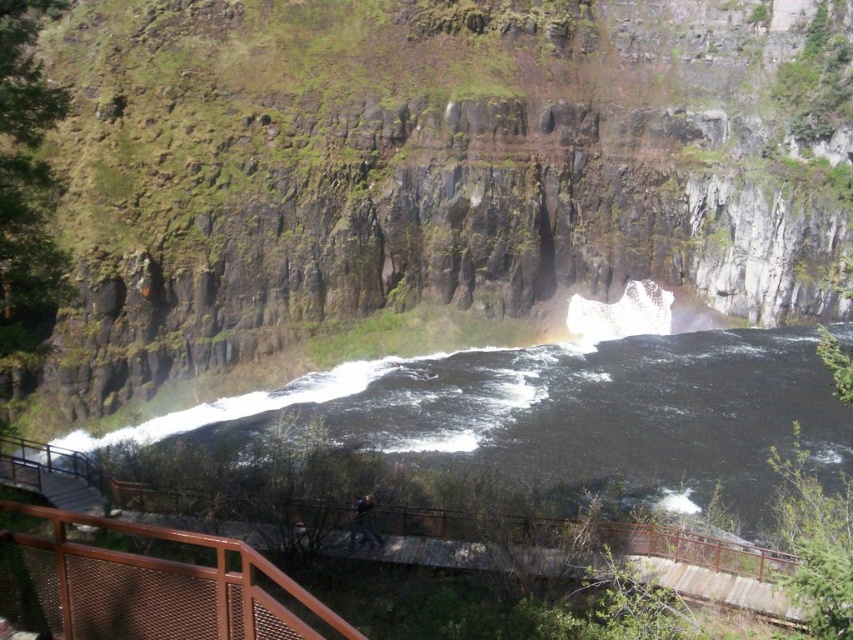
Question: Among these objects, which one is farthest from the camera?

Choices:
 (A) metal mesh railing at lower center
 (B) brown metal/rail at center
 (C) black water at center
 (D) green mossy rock at upper center

Answer: (D)

Question: Estimate the real-world distances between objects in this image. Which object is closer to the metal mesh railing at lower center?

Choices:
 (A) brown metal/rail at center
 (B) green mossy rock at upper center

Answer: (A)

Question: Is black water at center to the right of metal mesh railing at lower center from the viewer's perspective?

Choices:
 (A) no
 (B) yes

Answer: (B)

Question: Can you confirm if metal mesh railing at lower center is positioned to the left of brown metal/rail at center?

Choices:
 (A) yes
 (B) no

Answer: (A)

Question: Can you confirm if green mossy rock at upper center is positioned to the left of metal mesh railing at lower center?

Choices:
 (A) yes
 (B) no

Answer: (B)

Question: Which point is farther to the camera?

Choices:
 (A) (584, 468)
 (B) (78, 561)
 (C) (712, 545)
 (D) (339, 241)

Answer: (D)